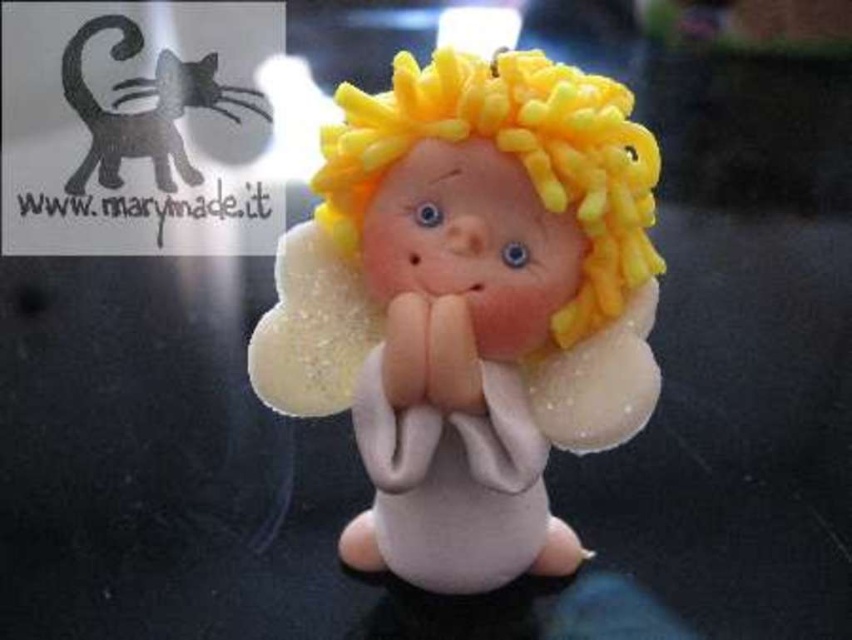
Based on the photo, you are an artist trying to sketch the angel figurine. You notice two points on the figurine marked as point (568, 320) and point (141, 152). Which point should you focus on first if you want to start drawing the part of the figurine that is closer to you?

Point (568, 320) is closer to the viewer than point (141, 152), so you should focus on point (568, 320) first.

You are a photographer setting up a shoot. You have a matte white angel at center and a matte black cat at upper left in your frame. Based on the scene description, where should you position your camera to ensure both subjects are in focus without moving them? Explain your reasoning.

The matte white angel at center is below the matte black cat at upper left. To ensure both are in focus, position the camera at eye level with the matte black cat at upper left, slightly angled downward so the depth of field captures both the angel and the cat. This placement maintains sharpness across the vertical distance between them.